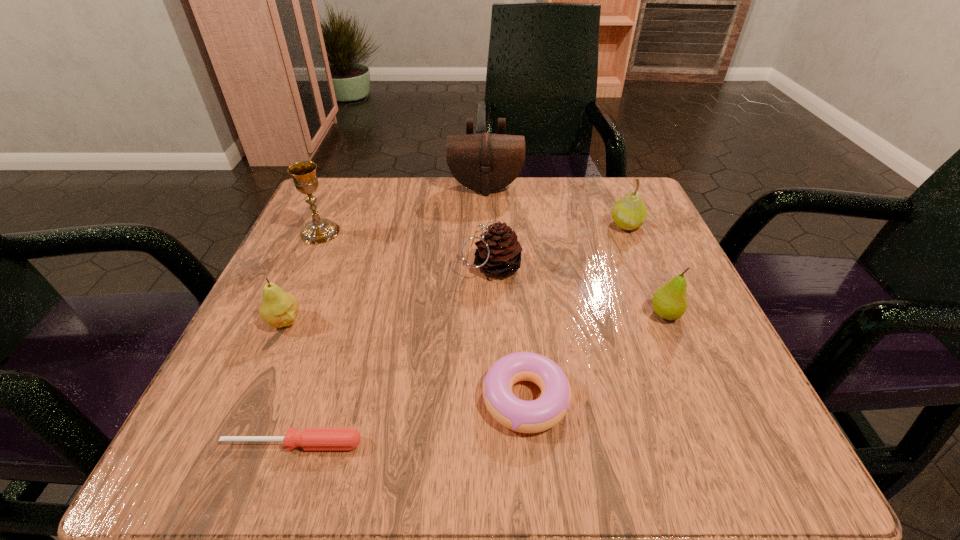
This screenshot has height=540, width=960. In order to click on free space located with a leaf charm attached to the fourth farthest object in this screenshot , I will do `click(407, 266)`.

Identify the location of vacant space located 0.100m with a leaf charm attached to the fourth farthest object. (407, 266).

You are a GUI agent. You are given a task and a screenshot of the screen. Output one action in this format:
    pyautogui.click(x=<x>, y=<y>)
    Task: Click on the vacant position located 0.270m with a leaf charm attached to the fourth farthest object
    The width and height of the screenshot is (960, 540).
    Given the screenshot: What is the action you would take?
    pyautogui.click(x=314, y=266)

At what (x,y) coordinates should I click in order to perform the action: click on vacant region located 0.260m on the right of the leftmost pear. Please return your answer as a coordinate pair (x, y). This screenshot has height=540, width=960. Looking at the image, I should click on (465, 321).

Find the location of `vacant space located 0.070m on the left of the seventh tallest object`. vacant space located 0.070m on the left of the seventh tallest object is located at coordinates (431, 399).

What are the coordinates of `free space located 0.180m on the back of the shortest object` in the screenshot? It's located at (331, 328).

This screenshot has width=960, height=540. I want to click on pouch that is positioned at the far edge, so click(485, 162).

Locate an element on the screen. The height and width of the screenshot is (540, 960). chalice at the far edge is located at coordinates (319, 230).

Identify the location of pear that is at the far edge. The image size is (960, 540). (629, 213).

The image size is (960, 540). Identify the location of doughnut situated at the near edge. (545, 412).